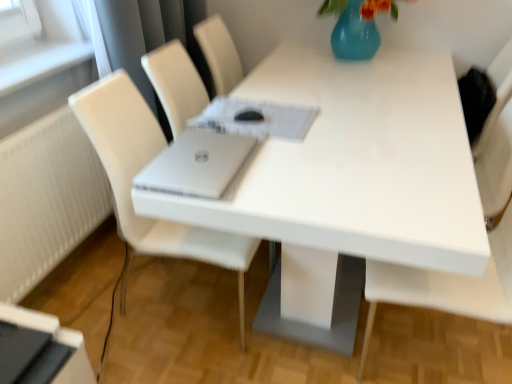
Question: Is white matte chair at right, which ranks as the second chair in left-to-right order, to the right of white glossy table at center from the viewer's perspective?

Choices:
 (A) yes
 (B) no

Answer: (A)

Question: Is white matte chair at right, which ranks as the second chair in left-to-right order, next to white glossy table at center?

Choices:
 (A) no
 (B) yes

Answer: (A)

Question: Could you tell me if white matte chair at right, which appears as the 1th chair when viewed from the right, is facing white glossy table at center?

Choices:
 (A) no
 (B) yes

Answer: (B)

Question: Does white matte chair at right, which appears as the 1th chair when viewed from the right, have a larger size compared to white glossy table at center?

Choices:
 (A) no
 (B) yes

Answer: (A)

Question: Is white matte chair at right, which ranks as the second chair in left-to-right order, positioned with its back to white glossy table at center?

Choices:
 (A) yes
 (B) no

Answer: (B)

Question: From a real-world perspective, is silver metallic laptop at center above or below white leather chair at center, the second chair positioned from the right?

Choices:
 (A) below
 (B) above

Answer: (B)

Question: Is silver metallic laptop at center spatially inside white leather chair at center, the second chair positioned from the right, or outside of it?

Choices:
 (A) inside
 (B) outside

Answer: (A)

Question: Considering the positions of point (206, 132) and point (121, 94), is point (206, 132) closer or farther from the camera than point (121, 94)?

Choices:
 (A) farther
 (B) closer

Answer: (B)

Question: Considering the positions of silver metallic laptop at center and white leather chair at center, the first chair in the left-to-right sequence, in the image, is silver metallic laptop at center bigger or smaller than white leather chair at center, the first chair in the left-to-right sequence,?

Choices:
 (A) big
 (B) small

Answer: (B)

Question: From the image's perspective, is white leather chair at center, the second chair positioned from the right, positioned above or below black glossy desktop at lower left?

Choices:
 (A) above
 (B) below

Answer: (A)

Question: Based on their positions, is white leather chair at center, the second chair positioned from the right, located to the left or right of black glossy desktop at lower left?

Choices:
 (A) right
 (B) left

Answer: (A)

Question: Choose the correct answer: Is white leather chair at center, the first chair in the left-to-right sequence, inside black glossy desktop at lower left or outside it?

Choices:
 (A) outside
 (B) inside

Answer: (A)

Question: In terms of size, does white leather chair at center, the second chair positioned from the right, appear bigger or smaller than black glossy desktop at lower left?

Choices:
 (A) big
 (B) small

Answer: (A)

Question: Is silver metallic laptop at center in front of or behind white matte chair at right, which ranks as the second chair in left-to-right order, in the image?

Choices:
 (A) front
 (B) behind

Answer: (B)

Question: From the image's perspective, relative to white matte chair at right, which appears as the 1th chair when viewed from the right, is silver metallic laptop at center above or below?

Choices:
 (A) below
 (B) above

Answer: (B)